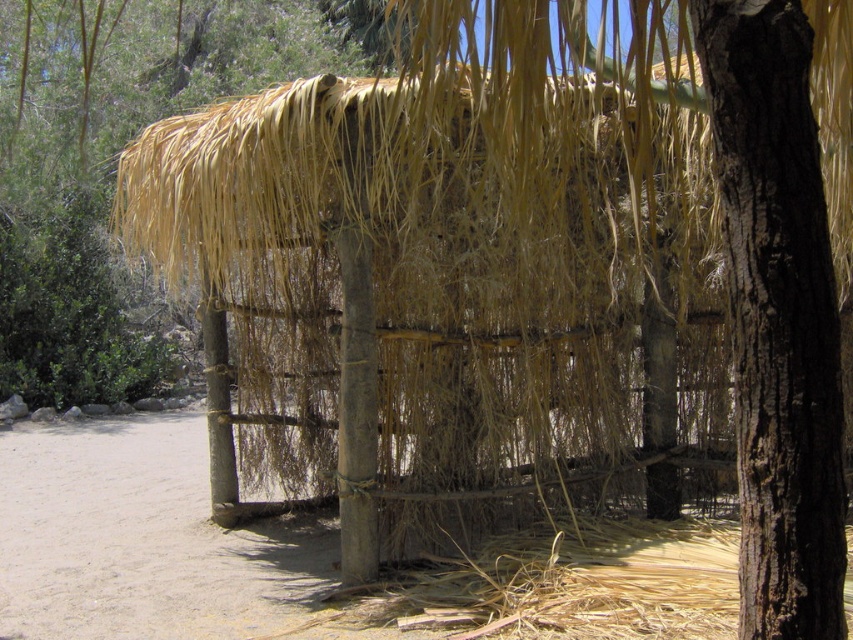
Question: Is brown rough bark tree at center behind brown rough wood pole at center?

Choices:
 (A) yes
 (B) no

Answer: (B)

Question: Is brown rough bark tree at center positioned in front of brown rough wood pole at center?

Choices:
 (A) no
 (B) yes

Answer: (B)

Question: Among these points, which one is farthest from the camera?

Choices:
 (A) (236, 476)
 (B) (817, 241)

Answer: (A)

Question: Which point is closer to the camera?

Choices:
 (A) (805, 586)
 (B) (219, 452)

Answer: (A)

Question: Does brown rough bark tree at center lie in front of brown rough wood pole at center?

Choices:
 (A) no
 (B) yes

Answer: (B)